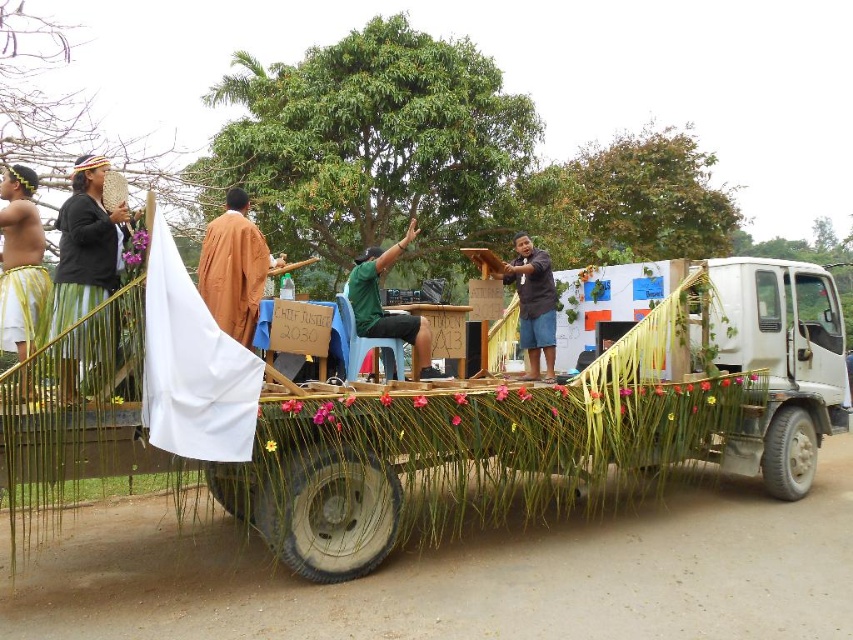
This screenshot has width=853, height=640. Describe the element at coordinates (233, 268) in the screenshot. I see `brown cloth at center` at that location.

In the scene shown: Does brown cloth at center appear under green matte shirt at center?

Incorrect, brown cloth at center is not positioned below green matte shirt at center.

The width and height of the screenshot is (853, 640). I want to click on brown cloth at center, so [233, 268].

The height and width of the screenshot is (640, 853). I want to click on brown cloth at center, so click(x=233, y=268).

Looking at this image, can you confirm if matte black woven hat at upper left is smaller than yellow grass skirt at left?

Yes.

Can you confirm if matte black woven hat at upper left is bigger than yellow grass skirt at left?

No, matte black woven hat at upper left is not bigger than yellow grass skirt at left.

Between point (91, 320) and point (10, 227), which one is positioned behind?

Positioned behind is point (10, 227).

Find the location of `matte black woven hat at upper left`. matte black woven hat at upper left is located at coordinates (85, 244).

Between yellow grass skirt at left and green matte shirt at center, which one is positioned lower?

green matte shirt at center

Does yellow grass skirt at left have a smaller size compared to green matte shirt at center?

Indeed, yellow grass skirt at left has a smaller size compared to green matte shirt at center.

Is point (4, 237) farther from viewer compared to point (378, 276)?

No, (4, 237) is in front of (378, 276).

You are a GUI agent. You are given a task and a screenshot of the screen. Output one action in this format:
    pyautogui.click(x=<x>, y=<y>)
    Task: Click on the yellow grass skirt at left
    
    Given the screenshot: What is the action you would take?
    pyautogui.click(x=20, y=262)